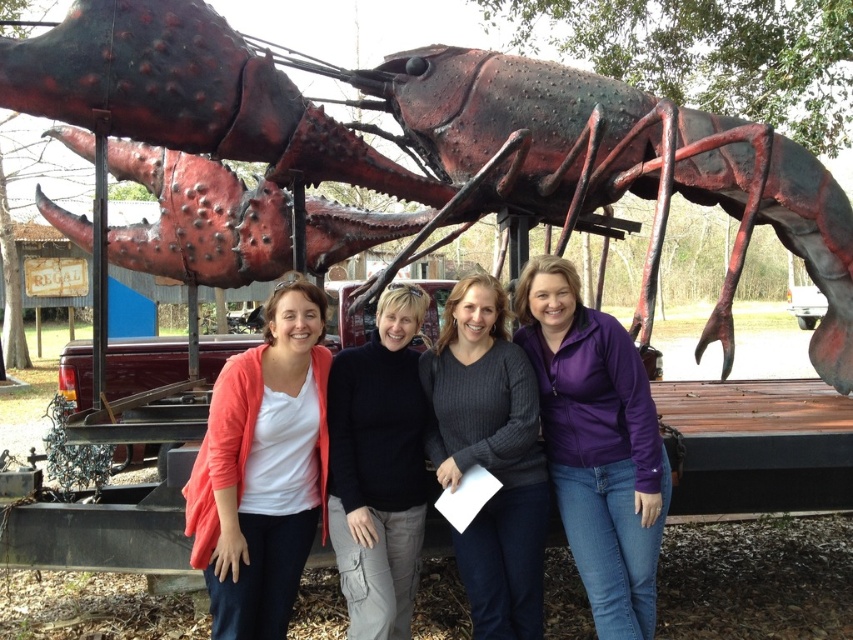
Question: Does matte orange cardigan at center have a greater width compared to purple fleece jacket at center?

Choices:
 (A) no
 (B) yes

Answer: (A)

Question: Is metallic red lobster at center bigger than purple fleece jacket at center?

Choices:
 (A) yes
 (B) no

Answer: (A)

Question: Which point is farther to the camera?

Choices:
 (A) purple fleece jacket at center
 (B) black turtleneck sweater at center
 (C) ribbed sweater at center

Answer: (C)

Question: Does ribbed sweater at center appear on the right side of black turtleneck sweater at center?

Choices:
 (A) no
 (B) yes

Answer: (B)

Question: Which of the following is the closest to the observer?

Choices:
 (A) matte orange cardigan at center
 (B) ribbed sweater at center
 (C) black turtleneck sweater at center
 (D) metallic red lobster at center

Answer: (D)

Question: Which object is farther from the camera taking this photo?

Choices:
 (A) ribbed sweater at center
 (B) metallic red lobster at center
 (C) matte orange cardigan at center
 (D) purple fleece jacket at center

Answer: (A)